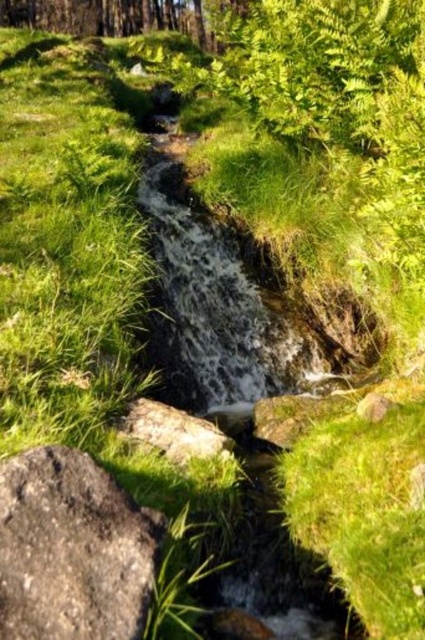
You are a hiker trying to cross the stream using the rocks. You need to step on both the gray rough rock at lower left and the gray rough rock at center. Which rock should you step on first to ensure the safest path?

You should step on the gray rough rock at lower left first because it is taller than the gray rough rock at center, providing a more stable and elevated position to start your crossing.

You are a hiker who wants to cross the stream using the rocks. You see the gray rough rock at lower left and the gray rough rock at center. Which rock should you step on first to cross the stream?

The gray rough rock at lower left is positioned on the left side of gray rough rock at center. Therefore, you should step on the gray rough rock at lower left first to cross the stream.